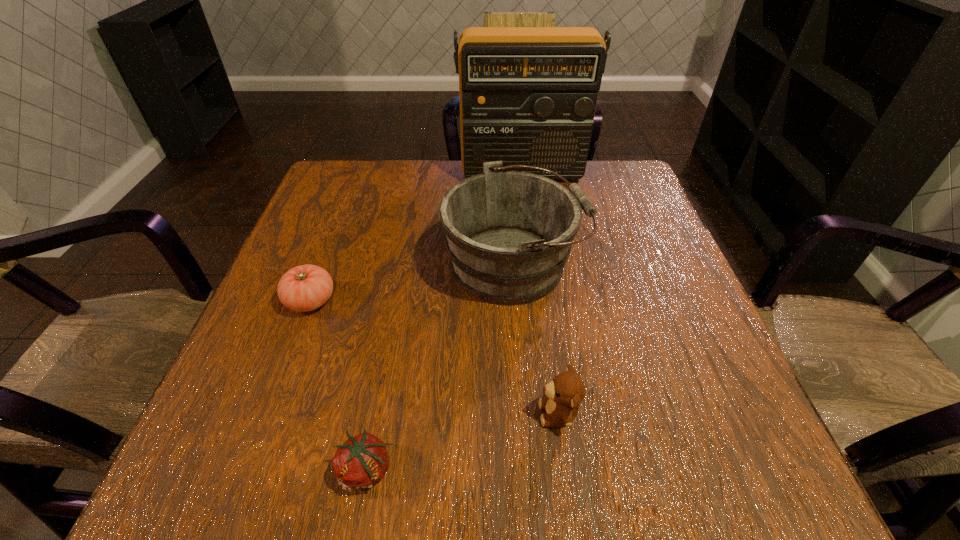
This screenshot has width=960, height=540. In order to click on the farthest object in this screenshot , I will do 528,95.

Image resolution: width=960 pixels, height=540 pixels. Identify the location of the tallest object. (528, 95).

In order to click on the fourth shortest object in this screenshot , I will do `click(509, 234)`.

Where is `the third shortest object`? The image size is (960, 540). the third shortest object is located at coordinates (565, 392).

Where is `the fourth farthest object`? This screenshot has width=960, height=540. the fourth farthest object is located at coordinates (565, 392).

What are the coordinates of `the farther tomato` in the screenshot? It's located at (303, 288).

This screenshot has height=540, width=960. Find the location of `the leftmost object`. the leftmost object is located at coordinates (303, 288).

Where is `the shortest object`? the shortest object is located at coordinates (361, 461).

Locate an element on the screen. the nearest object is located at coordinates (361, 461).

Where is `blank space located 0.310m on the front-facing side of the radio receiver`? blank space located 0.310m on the front-facing side of the radio receiver is located at coordinates (533, 262).